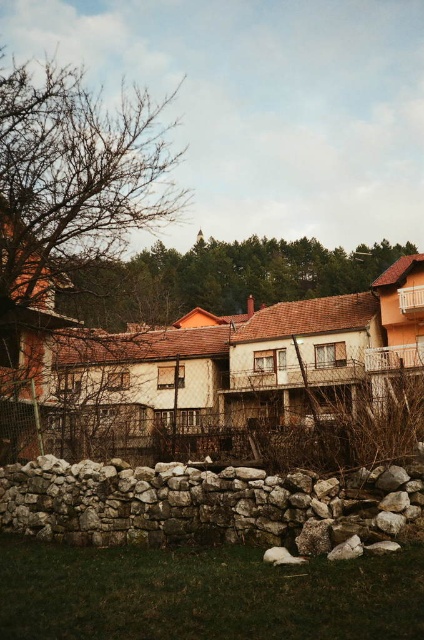
Question: Based on their relative distances, which object is farther from the gray rough stone wall at lower center?

Choices:
 (A) bare branches at upper left
 (B) brown textured tree at center

Answer: (B)

Question: Which object is the farthest from the bare branches at upper left?

Choices:
 (A) brown textured tree at center
 (B) gray rough stone wall at lower center

Answer: (B)

Question: From the image, what is the correct spatial relationship of bare branches at upper left in relation to brown textured tree at center?

Choices:
 (A) right
 (B) left

Answer: (B)

Question: Which object is positioned closest to the gray rough stone wall at lower center?

Choices:
 (A) brown textured tree at center
 (B) bare branches at upper left

Answer: (B)

Question: Is gray rough stone wall at lower center wider than brown textured tree at center?

Choices:
 (A) yes
 (B) no

Answer: (B)

Question: Is bare branches at upper left thinner than brown textured tree at center?

Choices:
 (A) yes
 (B) no

Answer: (A)